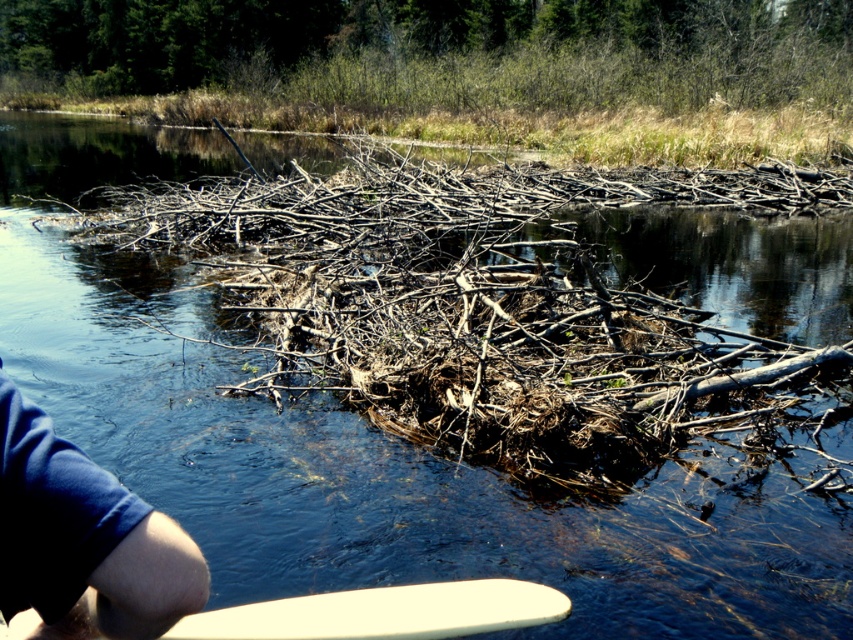
Who is lower down, blue fabric arm at lower left or white smooth surfboard at lower center?

white smooth surfboard at lower center is lower down.

Is blue fabric arm at lower left to the right of white smooth surfboard at lower center from the viewer's perspective?

Incorrect, blue fabric arm at lower left is not on the right side of white smooth surfboard at lower center.

I want to click on blue fabric arm at lower left, so click(x=84, y=538).

At what (x,y) coordinates should I click in order to perform the action: click on blue fabric arm at lower left. Please return your answer as a coordinate pair (x, y). The image size is (853, 640). Looking at the image, I should click on (84, 538).